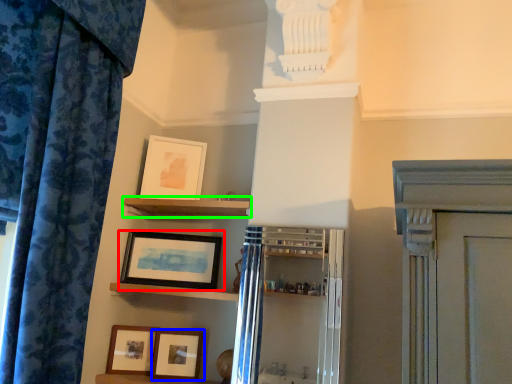
Question: Which is farther away from picture frame (highlighted by a red box)? picture frame (highlighted by a blue box) or shelf (highlighted by a green box)?

Choices:
 (A) picture frame
 (B) shelf

Answer: (A)